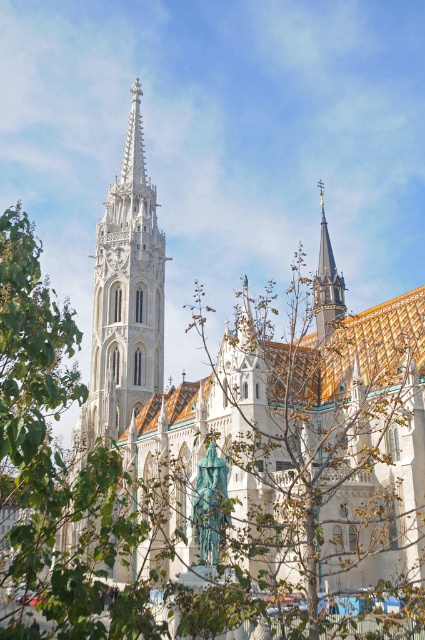
Who is shorter, green patinated metal statue at center or shiny gold spire at upper right?

Standing shorter between the two is green patinated metal statue at center.

Is point (193, 506) positioned in front of point (328, 323)?

That is True.

Locate an element on the screen. The height and width of the screenshot is (640, 425). green patinated metal statue at center is located at coordinates (209, 506).

Who is more forward, (163, 273) or (322, 326)?

Point (322, 326) is more forward.

Describe the element at coordinates (124, 305) in the screenshot. I see `white stone tower at center` at that location.

Locate an element on the screen. This screenshot has height=640, width=425. white stone tower at center is located at coordinates (124, 305).

Does point (340, 360) come closer to viewer compared to point (144, 388)?

Yes, it is.

Who is more distant from viewer, (294, 324) or (99, 426)?

Point (294, 324)

The width and height of the screenshot is (425, 640). What are the coordinates of `white stone church at center` in the screenshot? It's located at (257, 420).